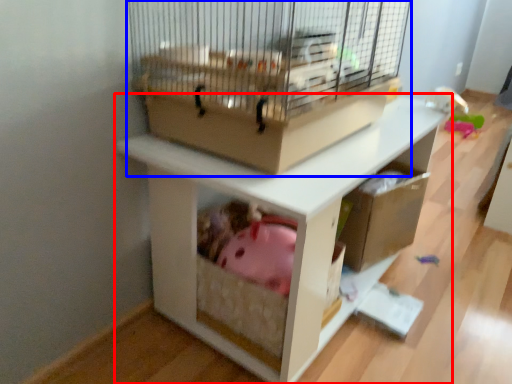
Question: Which object appears closest to the camera in this image, shelf (highlighted by a red box) or bird cage (highlighted by a blue box)?

Choices:
 (A) shelf
 (B) bird cage

Answer: (B)